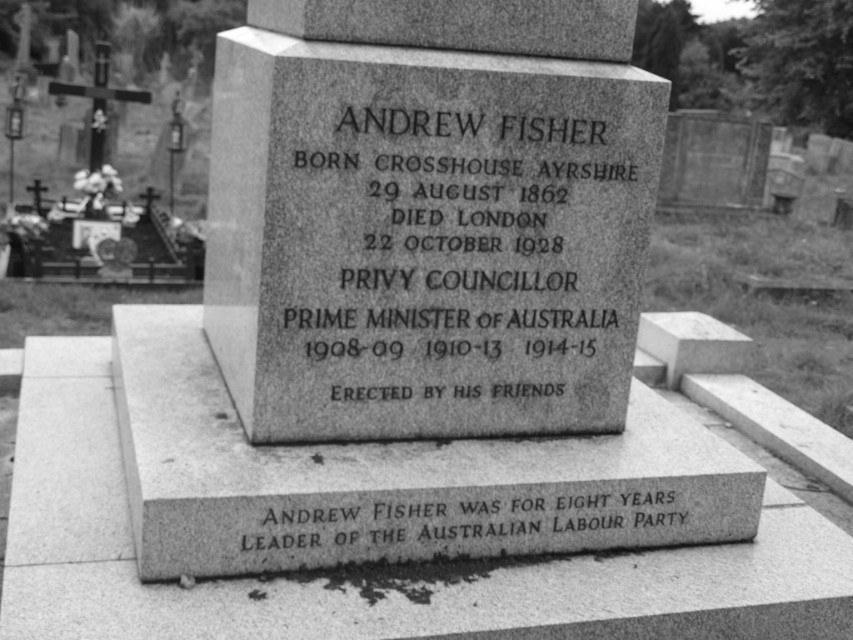
Question: Is granite plaque at center smaller than black granite text at lower center?

Choices:
 (A) no
 (B) yes

Answer: (A)

Question: Which object appears farthest from the camera in this image?

Choices:
 (A) granite plaque at center
 (B) black granite text at lower center

Answer: (A)

Question: Can you confirm if granite plaque at center is wider than black granite text at lower center?

Choices:
 (A) no
 (B) yes

Answer: (A)

Question: Which point appears closest to the camera in this image?

Choices:
 (A) tap(389, 371)
 (B) tap(589, 529)

Answer: (B)

Question: Which of the following is the closest to the observer?

Choices:
 (A) granite plaque at center
 (B) black granite text at lower center

Answer: (B)

Question: Is granite plaque at center bigger than black granite text at lower center?

Choices:
 (A) yes
 (B) no

Answer: (A)